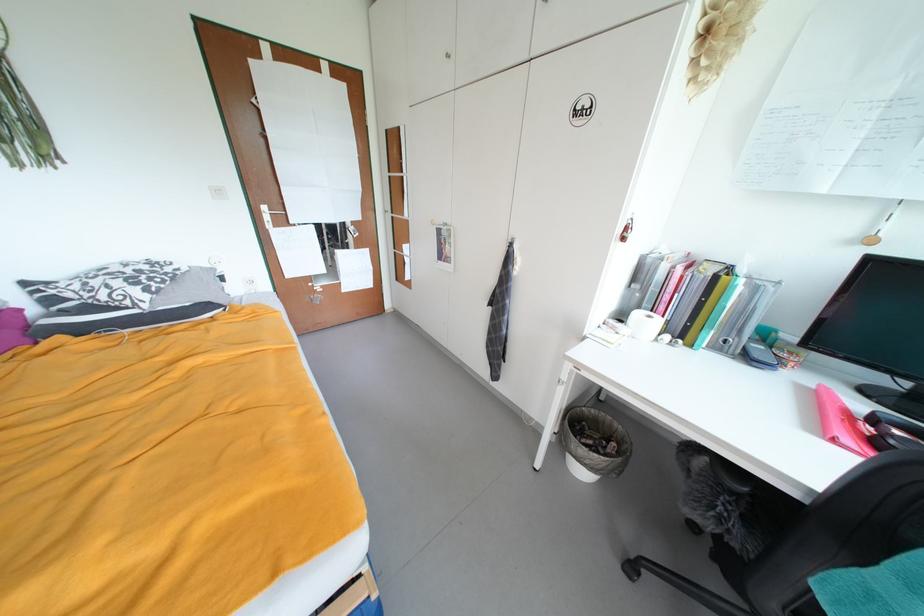
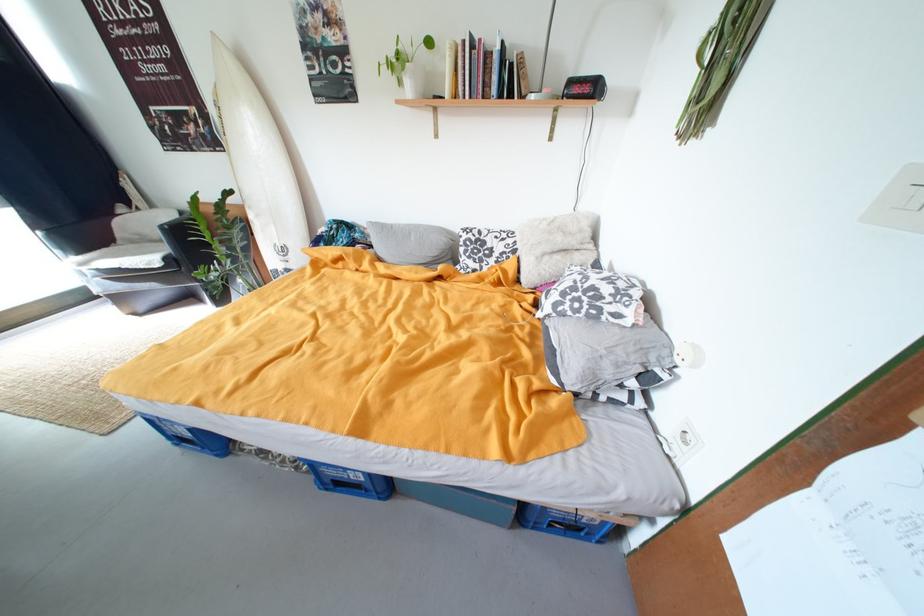
Find the pixel in the second image that matches the point at 154,292 in the first image.

(564, 306)